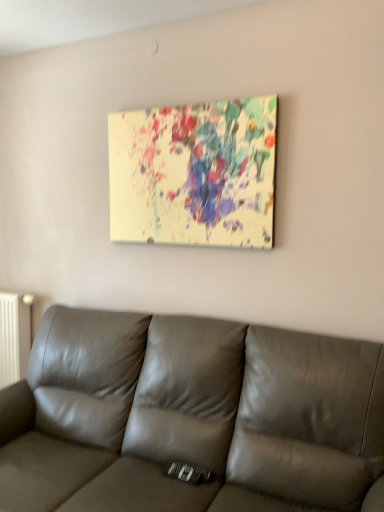
What are the coordinates of `leather couch at center` in the screenshot? It's located at (190, 417).

Measure the distance between painted canvas at upper center and camera.

They are 6.34 feet apart.

Describe the element at coordinates (194, 174) in the screenshot. I see `painted canvas at upper center` at that location.

What are the coordinates of `white matte radiator at left` in the screenshot? It's located at (14, 338).

Are painted canvas at upper center and white matte radiator at left beside each other?

painted canvas at upper center and white matte radiator at left are not in contact.

From their relative heights in the image, would you say painted canvas at upper center is taller or shorter than white matte radiator at left?

Clearly, painted canvas at upper center is shorter compared to white matte radiator at left.

From the image's perspective, between painted canvas at upper center and white matte radiator at left, which one is located above?

From the image's view, painted canvas at upper center is above.

Is white matte radiator at left not inside leather couch at center?

Yes, white matte radiator at left is located beyond the bounds of leather couch at center.

Is point (29, 298) in front of point (242, 329)?

That is False.

From a real-world perspective, is white matte radiator at left located higher than leather couch at center?

Yes, from a real-world perspective, white matte radiator at left is above leather couch at center.

From the image's perspective, is leather couch at center located above white matte radiator at left?

Incorrect, from the image's perspective, leather couch at center is lower than white matte radiator at left.

Is leather couch at center not within white matte radiator at left?

Yes, leather couch at center is not within white matte radiator at left.

Is leather couch at center to the right of white matte radiator at left from the viewer's perspective?

Yes, leather couch at center is to the right of white matte radiator at left.

Does leather couch at center have a smaller size compared to white matte radiator at left?

Incorrect, leather couch at center is not smaller in size than white matte radiator at left.

From the image's perspective, does white matte radiator at left appear lower than painted canvas at upper center?

Indeed, from the image's perspective, white matte radiator at left is shown beneath painted canvas at upper center.

In the image, is white matte radiator at left positioned in front of or behind painted canvas at upper center?

white matte radiator at left is behind painted canvas at upper center.

Can you confirm if white matte radiator at left is shorter than painted canvas at upper center?

No.

From a real-world perspective, is white matte radiator at left below painted canvas at upper center?

Yes, from a real-world perspective, white matte radiator at left is under painted canvas at upper center.

Considering the relative sizes of leather couch at center and painted canvas at upper center in the image provided, is leather couch at center shorter than painted canvas at upper center?

No, leather couch at center is not shorter than painted canvas at upper center.

How much distance is there between leather couch at center and painted canvas at upper center?

The distance of leather couch at center from painted canvas at upper center is 30.90 inches.

Is leather couch at center wider or thinner than painted canvas at upper center?

leather couch at center is wider than painted canvas at upper center.

In the image, is leather couch at center positioned in front of or behind painted canvas at upper center?

leather couch at center is positioned closer to the viewer than painted canvas at upper center.

Looking at this image, is painted canvas at upper center at the left side of leather couch at center?

Incorrect, painted canvas at upper center is not on the left side of leather couch at center.

How distant is painted canvas at upper center from leather couch at center?

A distance of 30.90 inches exists between painted canvas at upper center and leather couch at center.

Considering the relative positions of painted canvas at upper center and leather couch at center in the image provided, is painted canvas at upper center behind leather couch at center?

Yes, painted canvas at upper center is behind leather couch at center.

Find the location of a particular element. The width and height of the screenshot is (384, 512). picture frame above the leather couch at center (from a real-world perspective) is located at coordinates (194, 174).

This screenshot has height=512, width=384. What are the coordinates of `radiator on the left of the painted canvas at upper center` in the screenshot? It's located at [x=14, y=338].

The height and width of the screenshot is (512, 384). What are the coordinates of `studio couch located in front of the white matte radiator at left` in the screenshot? It's located at (190, 417).

Considering their positions, is leather couch at center positioned further to painted canvas at upper center than white matte radiator at left?

white matte radiator at left lies further to painted canvas at upper center than the other object.

Which object lies further to the anchor point leather couch at center, white matte radiator at left or painted canvas at upper center?

Among the two, white matte radiator at left is located further to leather couch at center.

Looking at the image, which one is located further to white matte radiator at left, leather couch at center or painted canvas at upper center?

painted canvas at upper center lies further to white matte radiator at left than the other object.

When comparing their distances from white matte radiator at left, does painted canvas at upper center or leather couch at center seem further?

painted canvas at upper center is positioned further to the anchor white matte radiator at left.

Based on their spatial positions, is painted canvas at upper center or white matte radiator at left further from leather couch at center?

white matte radiator at left is positioned further to the anchor leather couch at center.

Considering their positions, is white matte radiator at left positioned closer to painted canvas at upper center than leather couch at center?

leather couch at center is closer to painted canvas at upper center.

In order to click on picture frame located between leather couch at center and white matte radiator at left in the depth direction in this screenshot , I will do `click(194, 174)`.